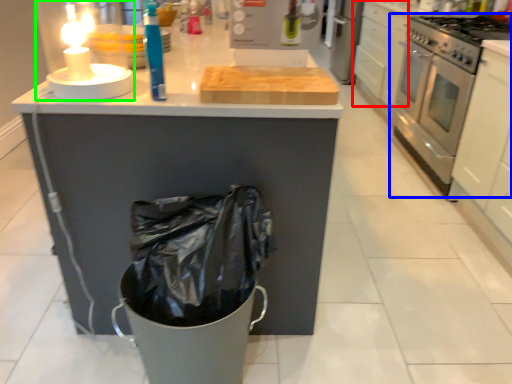
Question: Which object is positioned closest to drawer (highlighted by a red box)? Select from kitchen appliance (highlighted by a blue box) and candle holder (highlighted by a green box).

Choices:
 (A) kitchen appliance
 (B) candle holder

Answer: (A)